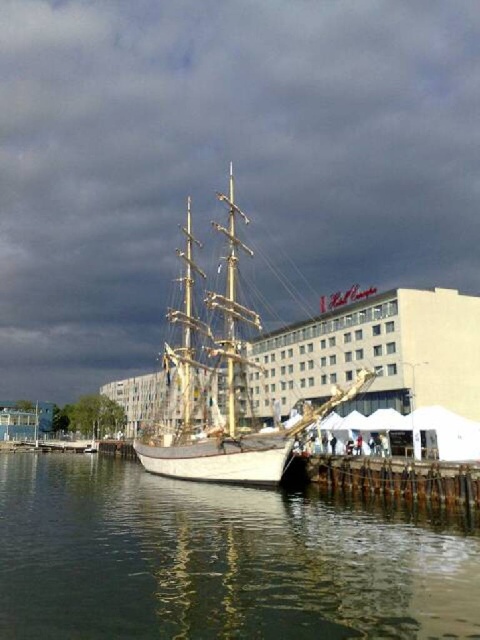
You are a tour guide explaining the scene to visitors. Pointing to the white wooden ship at center and the wooden at lower right, you want to highlight their sizes. Which object is taller?

The white wooden ship at center is taller than the wooden at lower right.

You are standing on the pier and see the clear water at lower center and the wooden at lower right. Which object is directly above the other?

The wooden at lower right is directly above the clear water at lower center because the clear water at lower center is positioned under wooden at lower right.

You are standing on the pier and want to take a photo of the ship. To ensure the clear water at lower center is in the foreground, where should you position yourself relative to the ship?

To have the clear water at lower center in the foreground, you should position yourself closer to the clear water at lower center, which is located at point (217, 561), so that it appears in front of the ship in your photo.